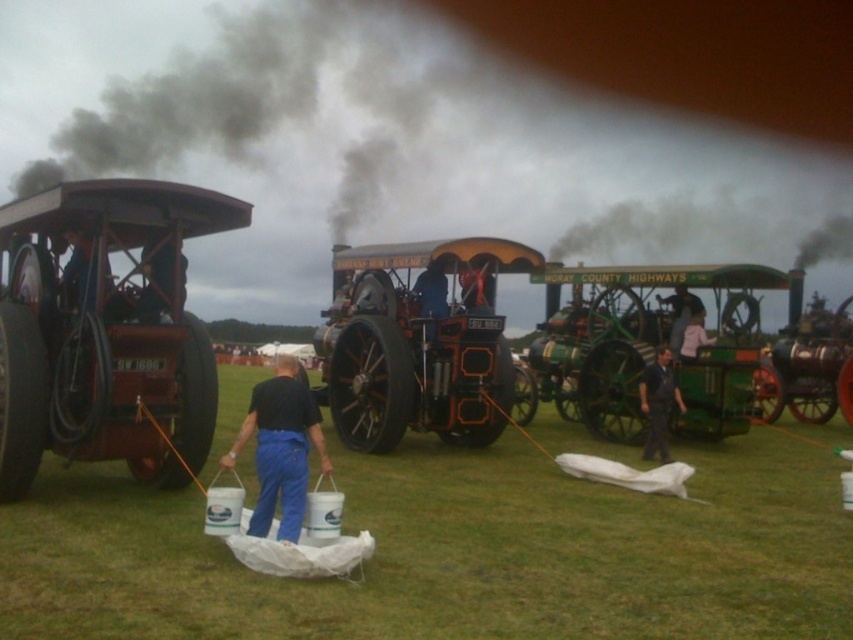
You are a photographer planning to take a photo of the matte black tractor at left and the dark blue fabric at center. You want to ensure both are in focus. Considering their heights, which object should you position closer to the camera to achieve this?

The matte black tractor at left is taller than the dark blue fabric at center. To have both in focus, position the matte black tractor at left closer to the camera so its height matches the dark blue fabric at center in the frame.

You are standing at the point with coordinates point (13, 294) and want to walk to the point with coordinates point (660, 404). Which direction should you move?

You should move backward since point (13, 294) is in front of point (660, 404).

From the picture: You are a photographer setting up a tripod in the center of the scene. You want to capture both the matte black tractor at left and the dark blue fabric at center in your shot. Which object will appear bigger in your photo?

The matte black tractor at left will appear bigger in the photo because it is larger in size than the dark blue fabric at center.